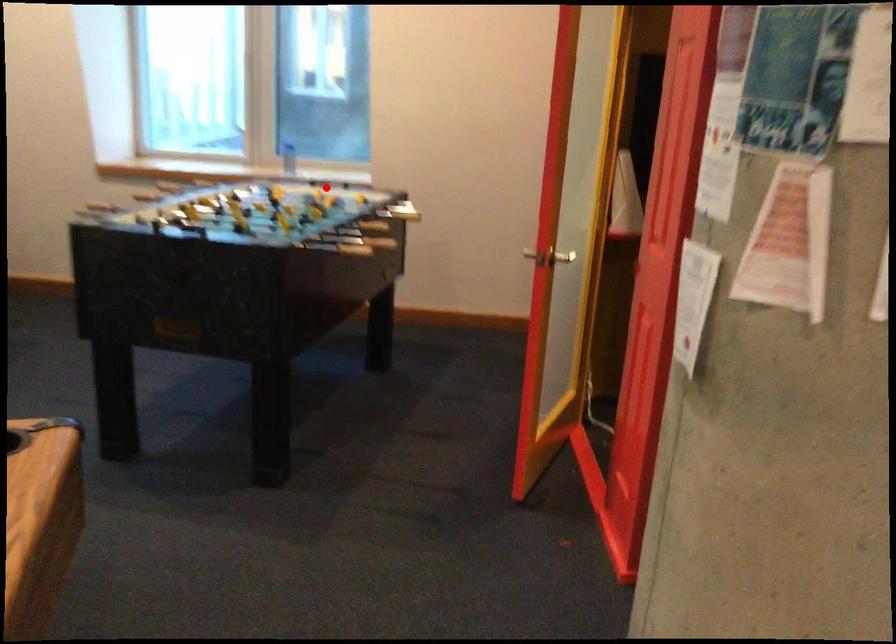
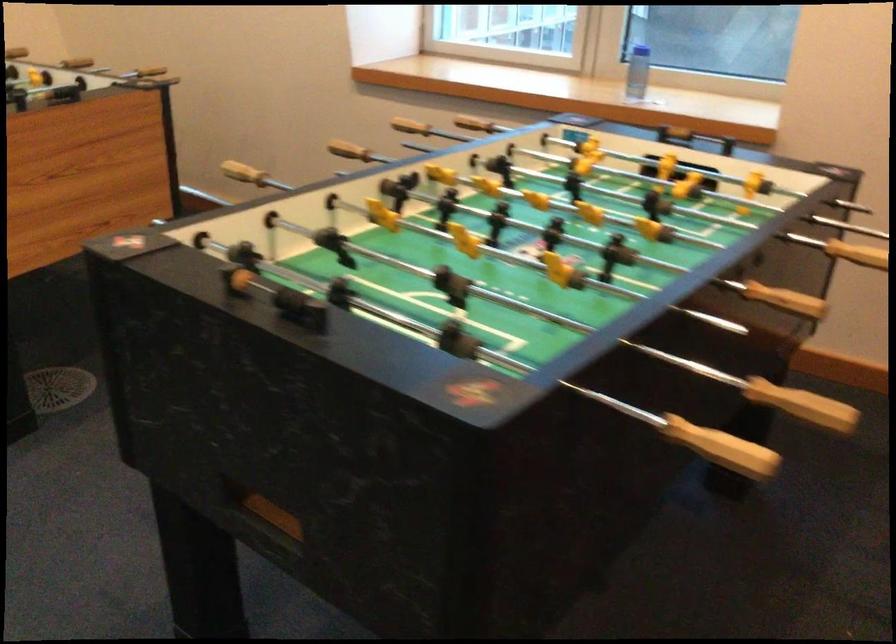
Question: I am providing you with two images of the same scene from different viewpoints. Given a red point in image1, look at the same physical point in image2. Is it:

Choices:
 (A) Closer to the viewpoint
 (B) Farther from the viewpoint

Answer: (A)